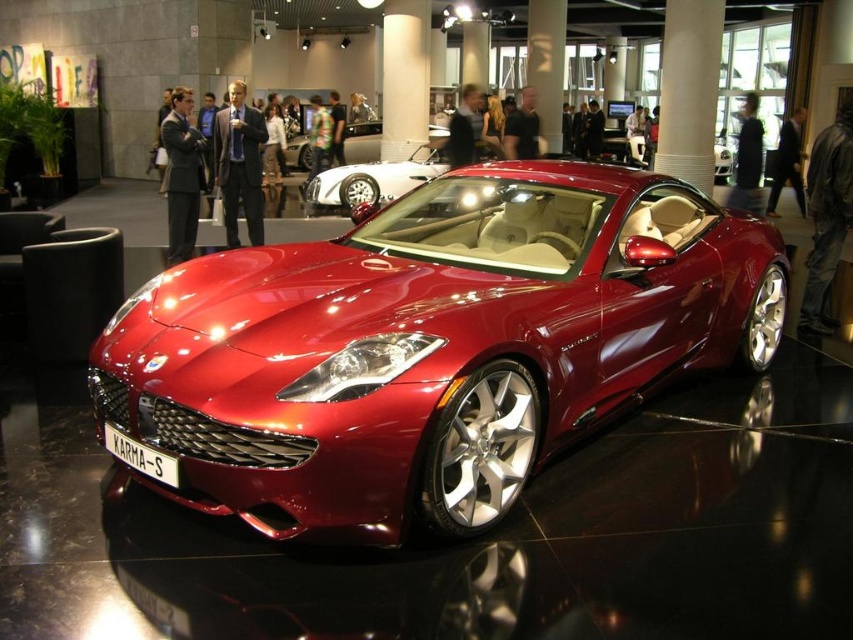
Does shiny metallic sports car at center have a greater height compared to shiny red car at center?

Indeed, shiny metallic sports car at center has a greater height compared to shiny red car at center.

Who is more distant from viewer, (x=337, y=384) or (x=387, y=184)?

The point (x=387, y=184) is more distant.

This screenshot has height=640, width=853. Identify the location of shiny metallic sports car at center. (428, 346).

Does shiny metallic sports car at center appear under glossy metallic car at center?

Indeed, shiny metallic sports car at center is positioned under glossy metallic car at center.

This screenshot has width=853, height=640. Identify the location of shiny metallic sports car at center. (428, 346).

Is point (514, 241) in front of point (350, 132)?

That is True.

Where is `shiny metallic sports car at center`? shiny metallic sports car at center is located at coordinates (428, 346).

Is shiny red car at center to the right of glossy metallic car at center from the viewer's perspective?

Yes, shiny red car at center is to the right of glossy metallic car at center.

Is point (376, 198) farther from camera compared to point (376, 125)?

No.

Find the location of `shiny red car at center`. shiny red car at center is located at coordinates (374, 179).

The image size is (853, 640). Find the location of `shiny red car at center`. shiny red car at center is located at coordinates (374, 179).